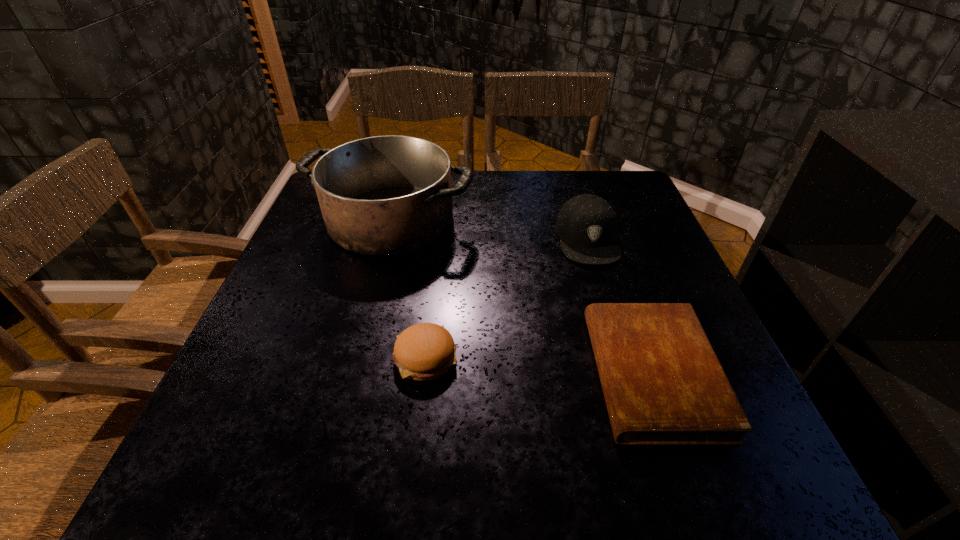
Find the location of `the closest object to the second shortest object`. the closest object to the second shortest object is located at coordinates (389, 195).

At what (x,y) coordinates should I click in order to perform the action: click on object that stands as the closest to the patty. Please return your answer as a coordinate pair (x, y). The width and height of the screenshot is (960, 540). Looking at the image, I should click on (389, 195).

Where is `vacant space that satisfies the following two spatial constraints: 1. on the front side of the saucepan; 2. on the right side of the third tallest object`? vacant space that satisfies the following two spatial constraints: 1. on the front side of the saucepan; 2. on the right side of the third tallest object is located at coordinates (354, 356).